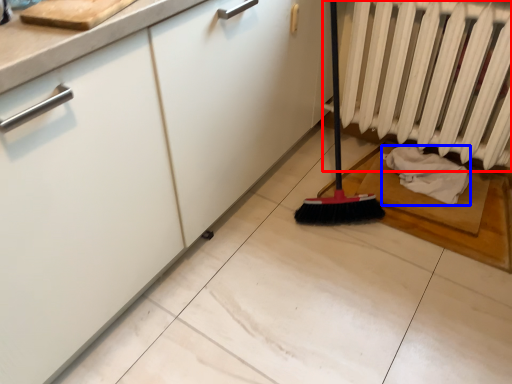
Question: Which point is closer to the camera, radiator (highlighted by a red box) or material (highlighted by a blue box)?

Choices:
 (A) radiator
 (B) material

Answer: (A)